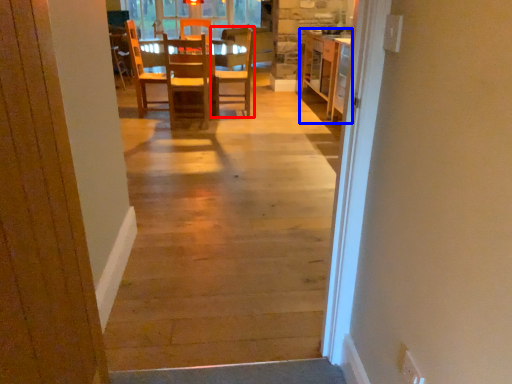
Question: Among these objects, which one is nearest to the camera, chair (highlighted by a red box) or cabinetry (highlighted by a blue box)?

Choices:
 (A) chair
 (B) cabinetry

Answer: (A)